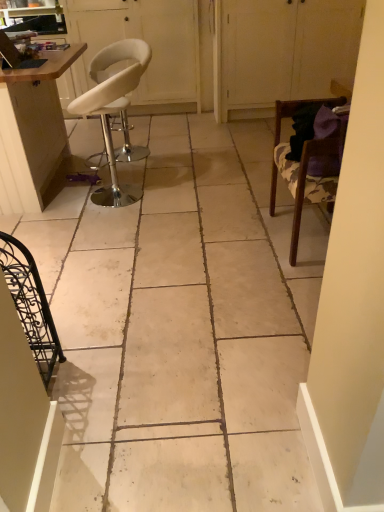
Where is `vacant area that lies between white leather stool at left, the 1th chair in the back-to-front sequence, and wooden chair at right, the first chair positioned from the right`? vacant area that lies between white leather stool at left, the 1th chair in the back-to-front sequence, and wooden chair at right, the first chair positioned from the right is located at coordinates click(203, 218).